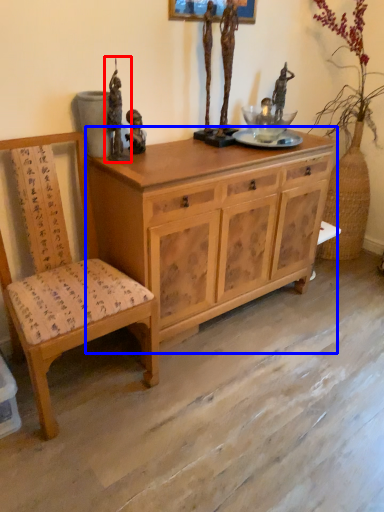
Question: Which object is closer to the camera taking this photo, sculpture (highlighted by a red box) or cabinetry (highlighted by a blue box)?

Choices:
 (A) sculpture
 (B) cabinetry

Answer: (B)